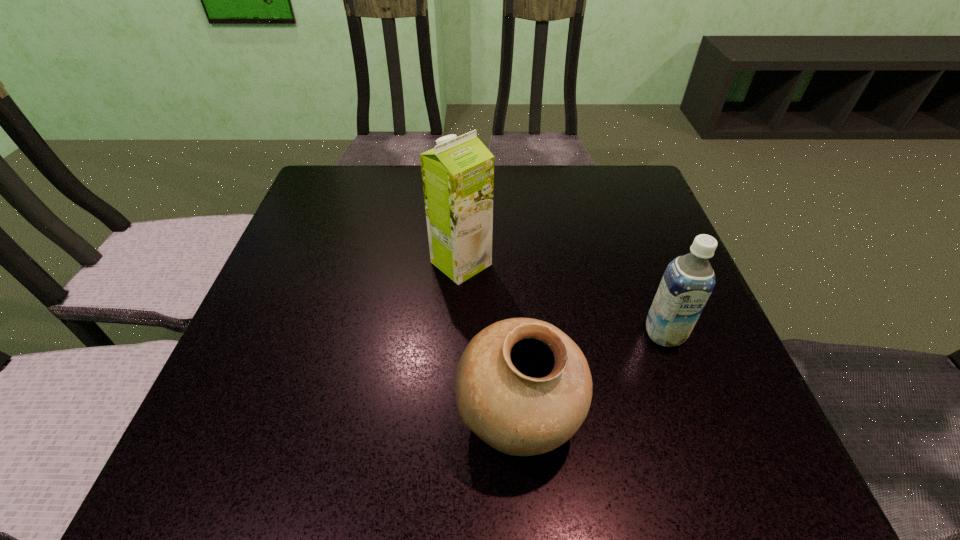
Where is `free space between the second nearest object and the left soya milk`? This screenshot has width=960, height=540. free space between the second nearest object and the left soya milk is located at coordinates (563, 298).

What are the coordinates of `object that is the second nearest to the pottery` in the screenshot? It's located at (458, 174).

Identify which object is the closest to the pottery. Please provide its 2D coordinates. Your answer should be formatted as a tuple, i.e. [(x, y)], where the tuple contains the x and y coordinates of a point satisfying the conditions above.

[(688, 281)]

Where is `vacant space that satisfies the following two spatial constraints: 1. on the front side of the tallest object; 2. on the left side of the pottery`? vacant space that satisfies the following two spatial constraints: 1. on the front side of the tallest object; 2. on the left side of the pottery is located at coordinates (454, 418).